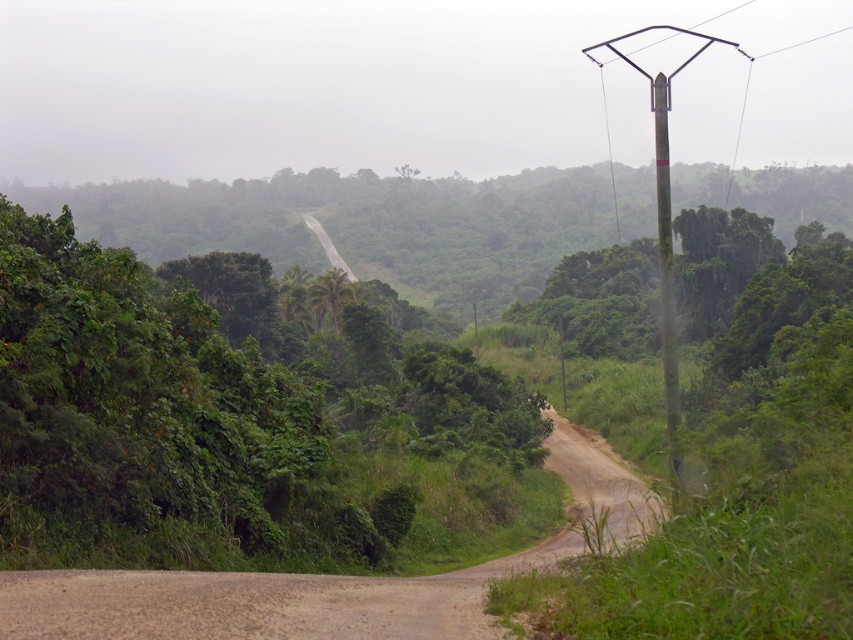
Who is more forward, (259, 428) or (616, 461)?

Point (259, 428) is in front.

Between green leafy tree at center and brown dirt track at center, which one is positioned higher?

green leafy tree at center is higher up.

Between point (379, 444) and point (364, 616), which one is positioned behind?

Positioned behind is point (379, 444).

Locate an element on the screen. green leafy tree at center is located at coordinates (241, 422).

Is green leafy tree at center to the right of green textured pole at right from the viewer's perspective?

Incorrect, green leafy tree at center is not on the right side of green textured pole at right.

Does point (62, 248) come closer to viewer compared to point (677, 369)?

Yes, point (62, 248) is closer to viewer.

Find the location of a particular element. The image size is (853, 640). green leafy tree at center is located at coordinates (241, 422).

Is the position of brown dirt track at center more distant than that of green textured pole at right?

No, brown dirt track at center is closer to the viewer.

Is point (67, 618) more distant than point (676, 465)?

No, it is not.

Who is more distant from viewer, (659,515) or (672,291)?

Point (672,291)

This screenshot has width=853, height=640. What are the coordinates of `brown dirt track at center` in the screenshot? It's located at (262, 602).